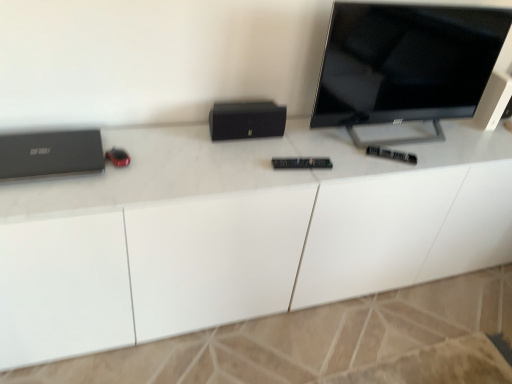
The image size is (512, 384). What are the coordinates of `empty space that is in between black matte speaker at center and matte black laptop at left` in the screenshot? It's located at (163, 148).